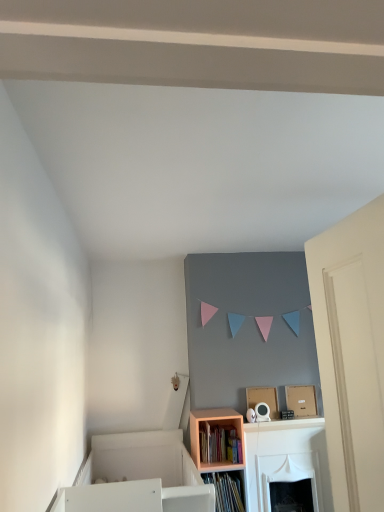
Find the location of a particular element. This screenshot has height=512, width=384. wooden bookshelf at lower center is located at coordinates (219, 444).

What do you see at coordinates (219, 444) in the screenshot?
I see `wooden bookshelf at lower center` at bounding box center [219, 444].

Measure the distance between peach wood shelf at lower center and camera.

peach wood shelf at lower center and camera are 3.02 meters apart from each other.

Image resolution: width=384 pixels, height=512 pixels. Describe the element at coordinates (217, 440) in the screenshot. I see `peach wood shelf at lower center` at that location.

Find the location of a particular element. The image size is (384, 512). peach wood shelf at lower center is located at coordinates (217, 440).

I want to click on wooden bookshelf at lower center, so click(x=219, y=444).

Considering the relative positions of peach wood shelf at lower center and wooden bookshelf at lower center in the image provided, is peach wood shelf at lower center to the left of wooden bookshelf at lower center from the viewer's perspective?

In fact, peach wood shelf at lower center is to the right of wooden bookshelf at lower center.

Is the position of peach wood shelf at lower center more distant than that of wooden bookshelf at lower center?

That is False.

Which is behind, point (212, 428) or point (221, 432)?

The point (221, 432) is more distant.

From the image's perspective, is peach wood shelf at lower center on wooden bookshelf at lower center?

Actually, peach wood shelf at lower center appears below wooden bookshelf at lower center in the image.

From a real-world perspective, which object rests below the other?

peach wood shelf at lower center, from a real-world perspective.

Between peach wood shelf at lower center and wooden bookshelf at lower center, which one has smaller width?

Thinner between the two is wooden bookshelf at lower center.

Based on the photo, does peach wood shelf at lower center have a lesser height compared to wooden bookshelf at lower center?

Incorrect, the height of peach wood shelf at lower center does not fall short of that of wooden bookshelf at lower center.

Considering the relative sizes of peach wood shelf at lower center and wooden bookshelf at lower center in the image provided, is peach wood shelf at lower center smaller than wooden bookshelf at lower center?

No, peach wood shelf at lower center is not smaller than wooden bookshelf at lower center.

Based on the photo, does peach wood shelf at lower center contain wooden bookshelf at lower center?

Yes.

Are peach wood shelf at lower center and wooden bookshelf at lower center making contact?

Yes, peach wood shelf at lower center is next to wooden bookshelf at lower center.

Is peach wood shelf at lower center turned away from wooden bookshelf at lower center?

Yes, peach wood shelf at lower center is positioned with its back facing wooden bookshelf at lower center.

What's the angular difference between peach wood shelf at lower center and wooden bookshelf at lower center's facing directions?

0.767 degrees.

The height and width of the screenshot is (512, 384). What are the coordinates of `book lying on the left of peach wood shelf at lower center` in the screenshot? It's located at (219, 444).

Considering the relative positions of wooden bookshelf at lower center and peach wood shelf at lower center in the image provided, is wooden bookshelf at lower center to the left or to the right of peach wood shelf at lower center?

Based on their positions, wooden bookshelf at lower center is located to the left of peach wood shelf at lower center.

Does wooden bookshelf at lower center lie behind peach wood shelf at lower center?

Yes, wooden bookshelf at lower center is behind peach wood shelf at lower center.

Is point (203, 449) farther from viewer compared to point (236, 420)?

No, (203, 449) is in front of (236, 420).

From the image's perspective, is wooden bookshelf at lower center located beneath peach wood shelf at lower center?

No, from the image's perspective, wooden bookshelf at lower center is not beneath peach wood shelf at lower center.

From a real-world perspective, between wooden bookshelf at lower center and peach wood shelf at lower center, who is vertically higher?

In real-world perspective, wooden bookshelf at lower center is above.

Considering the sizes of objects wooden bookshelf at lower center and peach wood shelf at lower center in the image provided, who is wider, wooden bookshelf at lower center or peach wood shelf at lower center?

Wider between the two is peach wood shelf at lower center.

Is wooden bookshelf at lower center taller than peach wood shelf at lower center?

No.

Is wooden bookshelf at lower center bigger or smaller than peach wood shelf at lower center?

In the image, wooden bookshelf at lower center appears to be smaller than peach wood shelf at lower center.

Is wooden bookshelf at lower center situated inside peach wood shelf at lower center or outside?

wooden bookshelf at lower center is contained in peach wood shelf at lower center.

Is wooden bookshelf at lower center beside peach wood shelf at lower center?

Yes, wooden bookshelf at lower center is with peach wood shelf at lower center.

Could you tell me if wooden bookshelf at lower center is turned towards peach wood shelf at lower center?

Yes, wooden bookshelf at lower center is oriented towards peach wood shelf at lower center.

What are the coordinates of `shelf on the right of wooden bookshelf at lower center` in the screenshot? It's located at (217, 440).

The height and width of the screenshot is (512, 384). I want to click on book that is above the peach wood shelf at lower center (from a real-world perspective), so click(x=219, y=444).

The image size is (384, 512). In order to click on shelf below the wooden bookshelf at lower center (from the image's perspective) in this screenshot , I will do `click(217, 440)`.